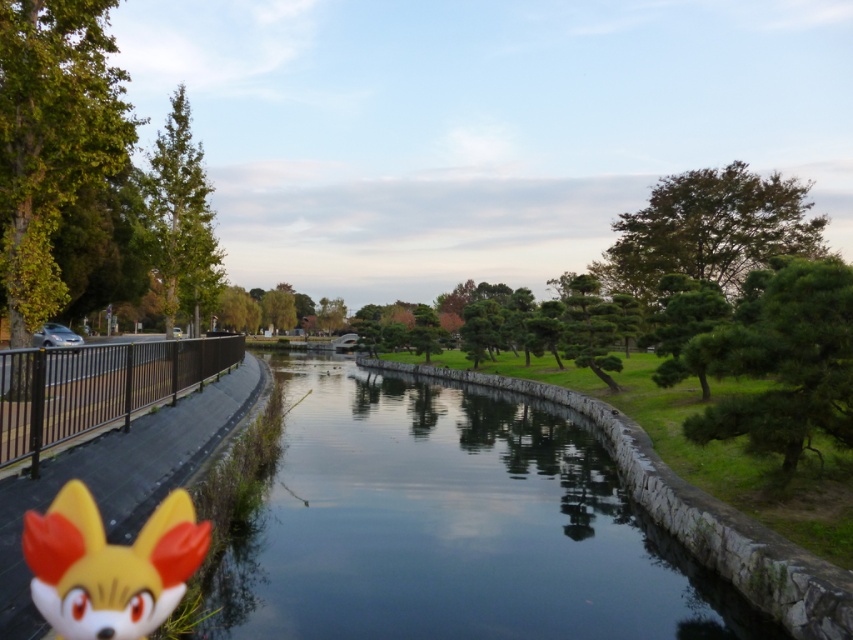
Between smooth stone river at center and yellow matte fox head at lower left, which one has less height?

With less height is yellow matte fox head at lower left.

Find the location of a particular element. The image size is (853, 640). smooth stone river at center is located at coordinates (451, 525).